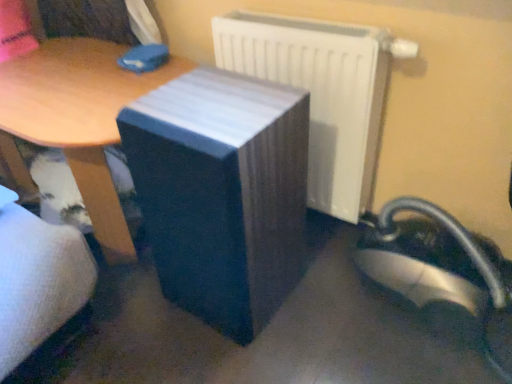
Question: Is white glossy radiator at upper right wider or thinner than matte black speaker at center, which is counted as the 1th table, starting from the right?

Choices:
 (A) thin
 (B) wide

Answer: (A)

Question: Considering the positions of white glossy radiator at upper right and matte black speaker at center, which is counted as the 1th table, starting from the right, in the image, is white glossy radiator at upper right bigger or smaller than matte black speaker at center, which is counted as the 1th table, starting from the right,?

Choices:
 (A) small
 (B) big

Answer: (A)

Question: Which is farther from the white glossy radiator at upper right?

Choices:
 (A) matte black speaker at center, which is the second table from left to right
 (B) wooden table at center, acting as the second table starting from the right

Answer: (B)

Question: Which object is positioned closest to the white glossy radiator at upper right?

Choices:
 (A) matte black speaker at center, which is the second table from left to right
 (B) wooden table at center, arranged as the 1th table when viewed from the left

Answer: (A)